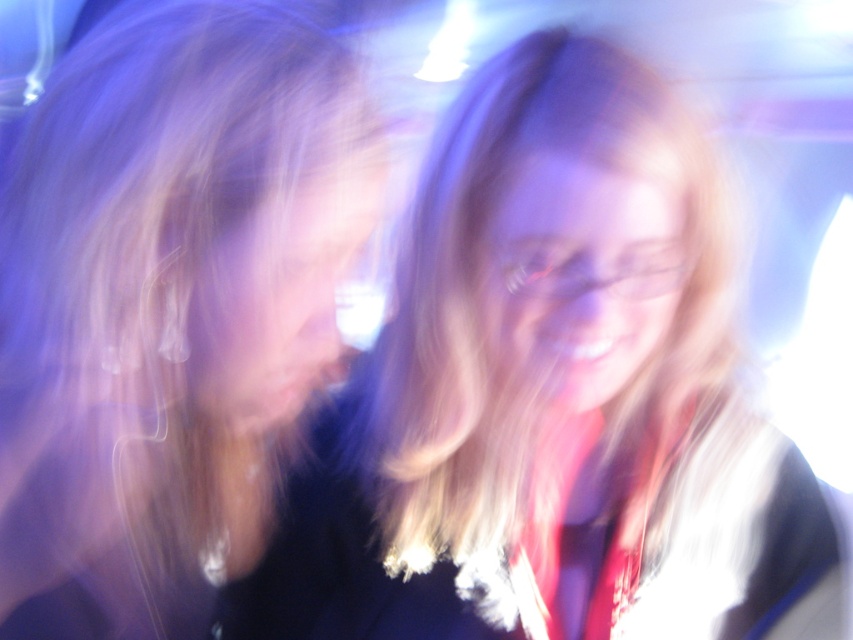
You are a photographer reviewing a motion blurred image. You notice two instances of blonde hair in the photo. One is labeled as blonde hair at center and the other as blonde hair at left. Based on the description, which of these two blonde hairs is closer to the camera?

The blonde hair at center is positioned under the blonde hair at left, meaning the blonde hair at left is closer to the camera.